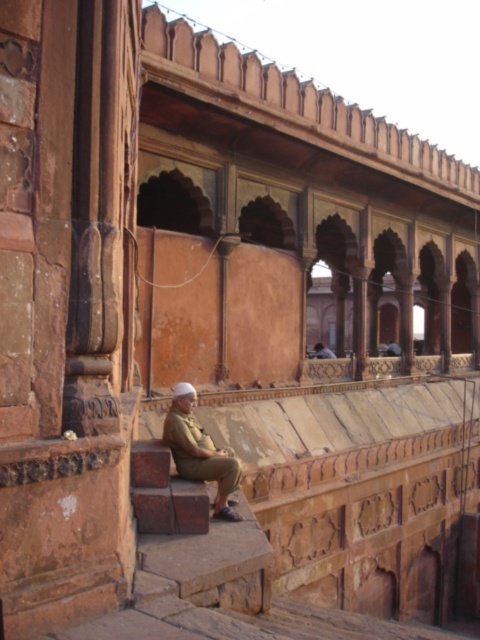
You are standing at the entrance of the historical site and want to find the khaki uniform at lower center. According to the coordinates given by point [200,451], in which direction should you look to locate it?

The khaki uniform at lower center is located at coordinates point [200,451], so you should look towards the lower center direction to find it.

You are a tourist visiting the historical site and want to take a photo of both the khaki uniform at lower center and the khaki uniform at center. Which khaki uniform is positioned lower in the image?

The khaki uniform at lower center is positioned lower than the khaki uniform at center.